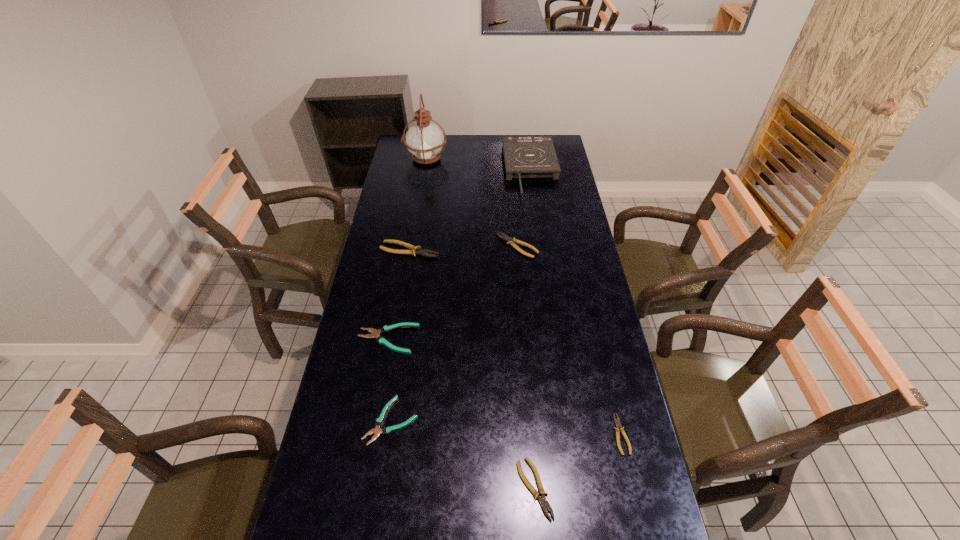
You are a GUI agent. You are given a task and a screenshot of the screen. Output one action in this format:
    pyautogui.click(x=<x>, y=<y>)
    Task: Click on the free space located on the left of the rightmost yellow pliers
    This screenshot has width=960, height=540.
    Given the screenshot: What is the action you would take?
    pyautogui.click(x=577, y=434)

What are the coordinates of `oil lamp that is at the far edge` in the screenshot? It's located at (425, 140).

Where is `hotplate that is at the far edge`? The height and width of the screenshot is (540, 960). hotplate that is at the far edge is located at coordinates (525, 157).

Find the location of a particular element. This screenshot has height=540, width=960. oil lamp that is at the left edge is located at coordinates (425, 140).

You are a GUI agent. You are given a task and a screenshot of the screen. Output one action in this format:
    pyautogui.click(x=<x>, y=<y>)
    Task: Click on the hotplate at the right edge
    Image resolution: width=960 pixels, height=540 pixels.
    Given the screenshot: What is the action you would take?
    pyautogui.click(x=525, y=157)

Locate an element on the screen. Image resolution: width=960 pixels, height=540 pixels. pliers at the right edge is located at coordinates (617, 422).

You are a GUI agent. You are given a task and a screenshot of the screen. Output one action in this format:
    pyautogui.click(x=<x>, y=<y>)
    Task: Click on the object that is at the far left corner
    The height and width of the screenshot is (540, 960).
    Given the screenshot: What is the action you would take?
    pyautogui.click(x=425, y=140)

Identify the location of object that is at the far right corner. (525, 157).

I want to click on free region at the left edge of the desktop, so click(x=381, y=382).

Find the location of a particular element. Image resolution: width=960 pixels, height=540 pixels. vacant area at the right edge of the desktop is located at coordinates (585, 407).